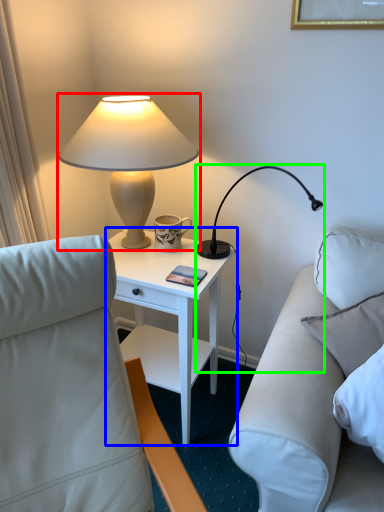
Question: Which is nearer to the lamp (highlighted by a red box)? nightstand (highlighted by a blue box) or lamp (highlighted by a green box).

Choices:
 (A) nightstand
 (B) lamp

Answer: (A)